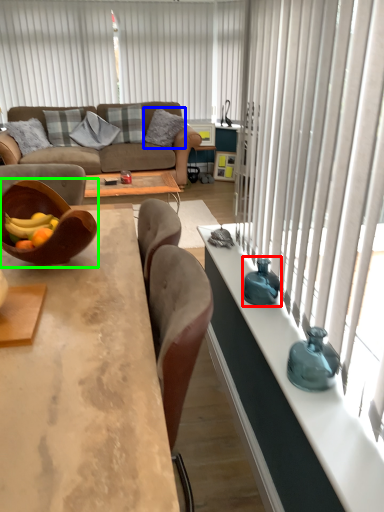
Question: Considering the real-world distances, which object is closest to vase (highlighted by a red box)? pillow (highlighted by a blue box) or bowl (highlighted by a green box).

Choices:
 (A) pillow
 (B) bowl

Answer: (B)